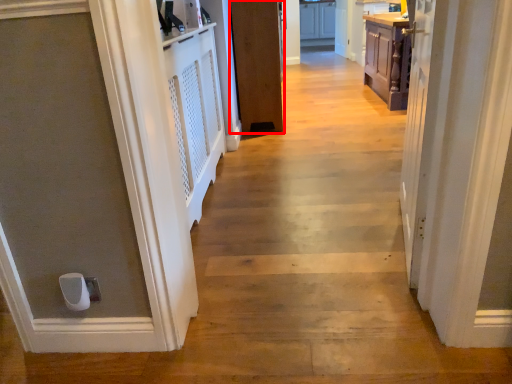
Question: From the image's perspective, considering the relative positions of door (annotated by the red box) and cabinetry in the image provided, where is door (annotated by the red box) located with respect to the staircase?

Choices:
 (A) below
 (B) above

Answer: (A)